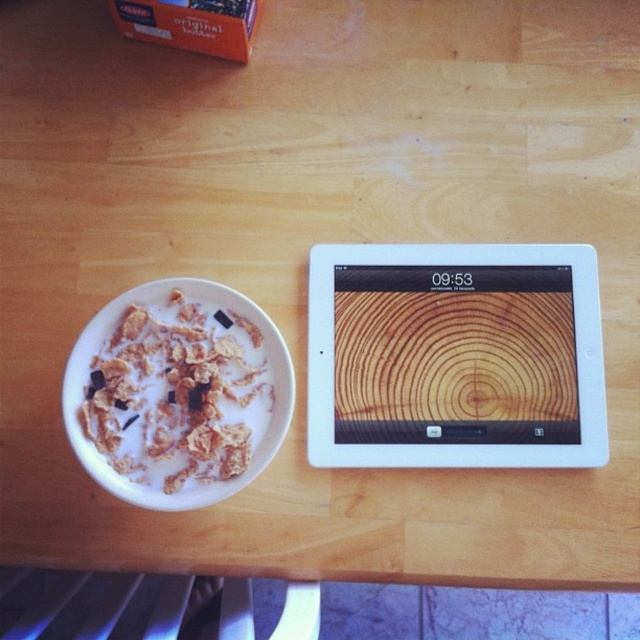
Is white glossy tablet at upper center taller than white matte bowl at left?

Indeed, white glossy tablet at upper center has a greater height compared to white matte bowl at left.

Is point (442, 352) positioned behind point (241, 486)?

Yes, point (442, 352) is behind point (241, 486).

Is point (458, 262) positioned behind point (122, 323)?

Yes, point (458, 262) is behind point (122, 323).

Where is `white glossy tablet at upper center`? The height and width of the screenshot is (640, 640). white glossy tablet at upper center is located at coordinates (454, 356).